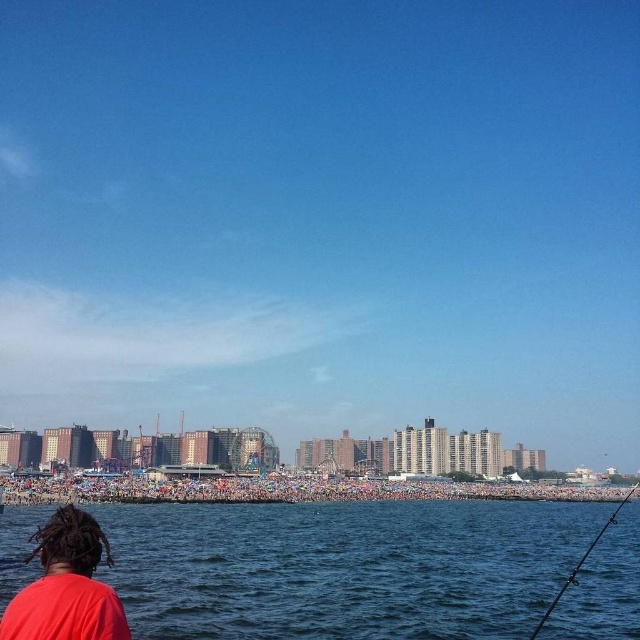
Does blue water at lower center have a lesser height compared to red matte shirt at lower left?

In fact, blue water at lower center may be taller than red matte shirt at lower left.

Is point (285, 566) closer to camera compared to point (120, 609)?

No, it is behind (120, 609).

Is point (211, 515) closer to viewer compared to point (38, 552)?

That is False.

The width and height of the screenshot is (640, 640). Identify the location of blue water at lower center. (342, 566).

Is red matte shirt at lower left above black plastic fishing pole at lower right?

Yes.

Is red matte shirt at lower left taller than black plastic fishing pole at lower right?

Yes, red matte shirt at lower left is taller than black plastic fishing pole at lower right.

Is point (60, 612) positioned after point (595, 538)?

No, (60, 612) is closer to viewer.

Locate an element on the screen. red matte shirt at lower left is located at coordinates (67, 586).

Can you confirm if blue water at lower center is shorter than black plastic fishing pole at lower right?

No, blue water at lower center is not shorter than black plastic fishing pole at lower right.

Which is behind, point (410, 582) or point (596, 538)?

The point (596, 538) is more distant.

Locate an element on the screen. The image size is (640, 640). blue water at lower center is located at coordinates (342, 566).